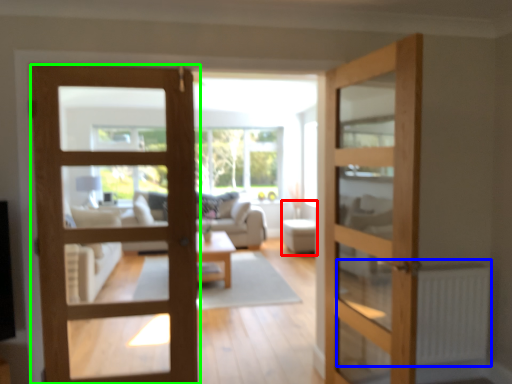
Question: Which is nearer to the furniture (highlighted by a red box)? radiator (highlighted by a blue box) or door (highlighted by a green box).

Choices:
 (A) radiator
 (B) door

Answer: (A)